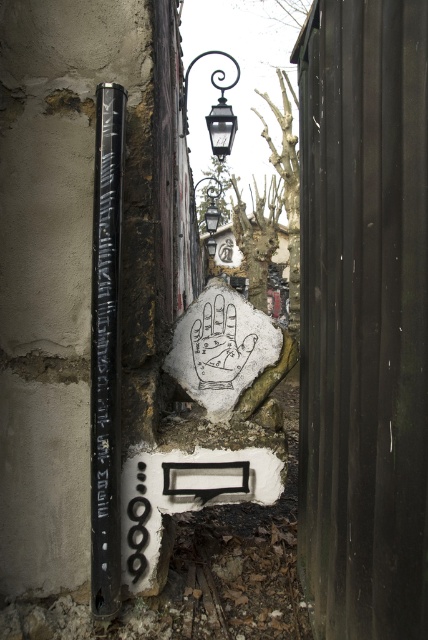
Is black polished metal pole at left to the right of polished metal streetlamp at upper center from the viewer's perspective?

No, black polished metal pole at left is not to the right of polished metal streetlamp at upper center.

Who is more forward, (92, 600) or (208, 113)?

Point (92, 600) is in front.

Where is `black polished metal pole at left`? This screenshot has width=428, height=640. black polished metal pole at left is located at coordinates (106, 353).